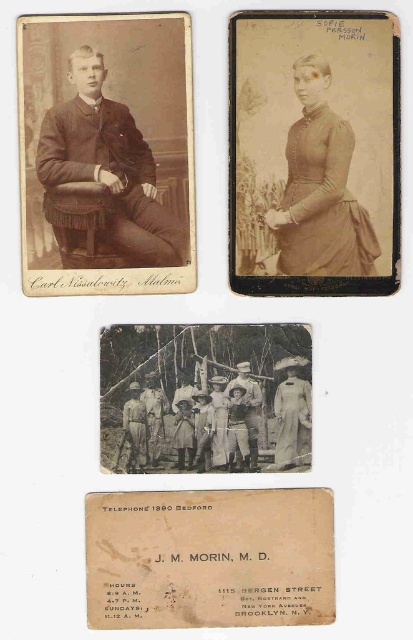
How much distance is there between matte brown suit at center and khaki cotton uniform at center?

matte brown suit at center and khaki cotton uniform at center are 13.47 inches apart.

Does matte brown suit at center have a greater width compared to khaki cotton uniform at center?

Yes, matte brown suit at center is wider than khaki cotton uniform at center.

Between point (104, 147) and point (246, 365), which one is positioned behind?

The point (246, 365) is behind.

Locate an element on the screen. matte brown suit at center is located at coordinates (102, 173).

Who is taller, vintage paper postcard at center or matte brown dress at center?

matte brown dress at center is taller.

Does vintage paper postcard at center appear over matte brown dress at center?

Incorrect, vintage paper postcard at center is not positioned above matte brown dress at center.

Which is in front, point (163, 545) or point (341, 268)?

Positioned in front is point (163, 545).

Identify the location of vintage paper postcard at center. (209, 557).

Between black and white photograph of group at center and khaki cotton uniform at center, which one is positioned higher?

black and white photograph of group at center is above.

Who is taller, black and white photograph of group at center or khaki cotton uniform at center?

black and white photograph of group at center

Is point (227, 410) farther from camera compared to point (253, 406)?

That is True.

Find the location of `black and white photograph of group at center`. black and white photograph of group at center is located at coordinates (206, 397).